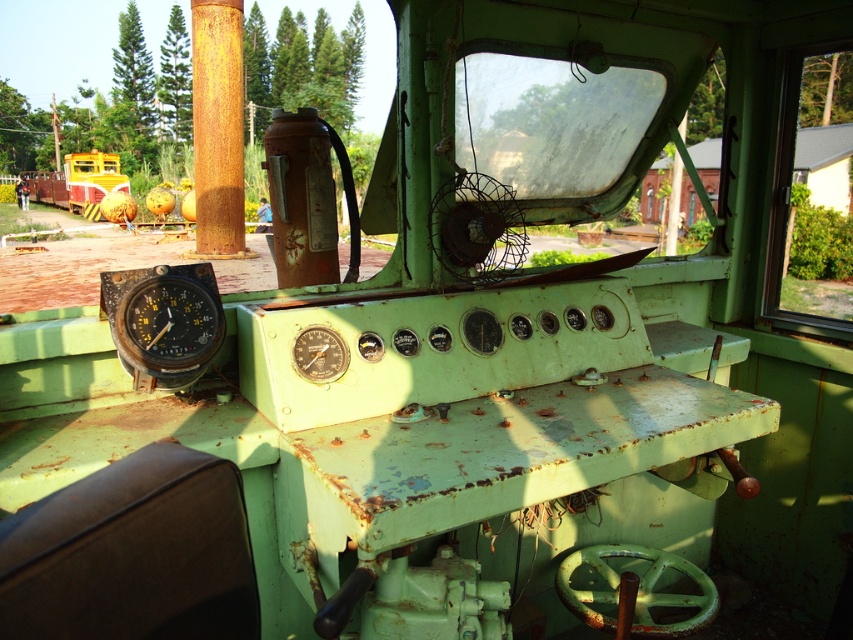
Does yellow painted metal train at left appear on the right side of matte black gauge at center?

In fact, yellow painted metal train at left is to the left of matte black gauge at center.

Can you confirm if yellow painted metal train at left is bigger than matte black gauge at center?

Indeed, yellow painted metal train at left has a larger size compared to matte black gauge at center.

Who is more distant from viewer, [48,172] or [308,364]?

The point [48,172] is behind.

The width and height of the screenshot is (853, 640). Identify the location of yellow painted metal train at left. (78, 180).